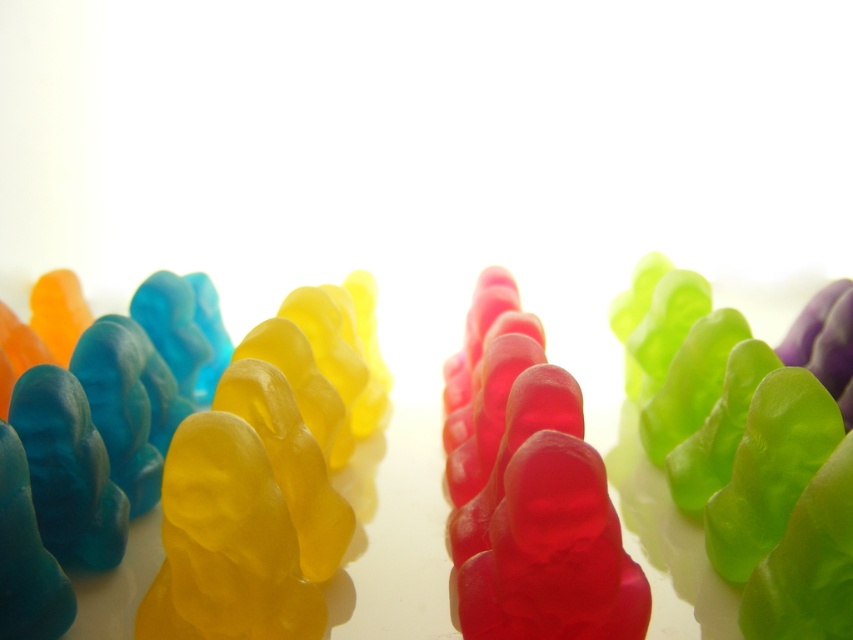
Is point (345, 305) farther from viewer compared to point (554, 458)?

Yes, point (345, 305) is farther from viewer.

Is point (51, 563) less distant than point (567, 609)?

No.

Does point (312, 312) come farther from viewer compared to point (543, 552)?

Yes, it is behind point (543, 552).

Where is `yellow translucent gummy bear at left`? yellow translucent gummy bear at left is located at coordinates (189, 460).

Looking at this image, can you confirm if translucent gelatin bear at center is taller than yellow translucent gummy bear at left?

Yes, translucent gelatin bear at center is taller than yellow translucent gummy bear at left.

Is translucent gelatin bear at center positioned behind yellow translucent gummy bear at left?

No.

Who is more forward, (x=817, y=556) or (x=199, y=340)?

Point (x=817, y=556)

In order to click on translucent gelatin bear at center in this screenshot , I will do `click(187, 456)`.

Does translucent gelatin bear at center have a lesser width compared to translucent jelly bear at center?

No.

The height and width of the screenshot is (640, 853). Find the location of `translucent gelatin bear at center`. translucent gelatin bear at center is located at coordinates (187, 456).